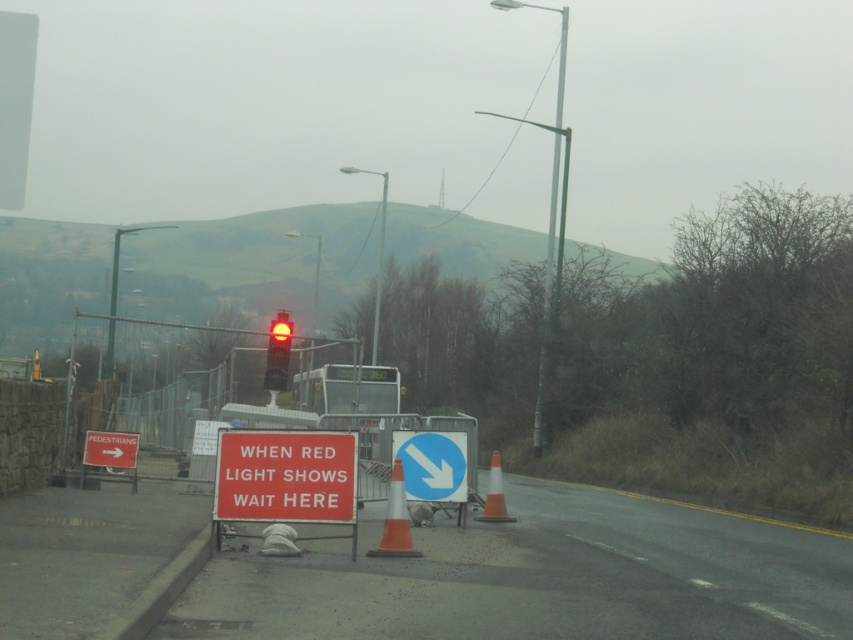
Looking at this image, is red glass traffic light at center shorter than orange reflective cone at center?

No.

Who is lower down, red glass traffic light at center or orange reflective cone at center?

orange reflective cone at center is lower down.

Between point (283, 323) and point (490, 470), which one is positioned behind?

The point (283, 323) is more distant.

Locate an element on the screen. red glass traffic light at center is located at coordinates (277, 353).

Between blue plastic traffic sign at center and red glass traffic light at center, which one is positioned lower?

blue plastic traffic sign at center

Image resolution: width=853 pixels, height=640 pixels. What do you see at coordinates (432, 465) in the screenshot? I see `blue plastic traffic sign at center` at bounding box center [432, 465].

Find the location of `blue plastic traffic sign at center`. blue plastic traffic sign at center is located at coordinates (432, 465).

Locate an element on the screen. blue plastic traffic sign at center is located at coordinates (432, 465).

What do you see at coordinates (395, 520) in the screenshot? I see `orange/reflective traffic cone at center` at bounding box center [395, 520].

Between point (387, 499) and point (289, 330), which one is positioned behind?

The point (289, 330) is behind.

Is point (392, 509) positioned in front of point (279, 387)?

Yes, it is.

Image resolution: width=853 pixels, height=640 pixels. Find the location of `orange/reflective traffic cone at center`. orange/reflective traffic cone at center is located at coordinates (395, 520).